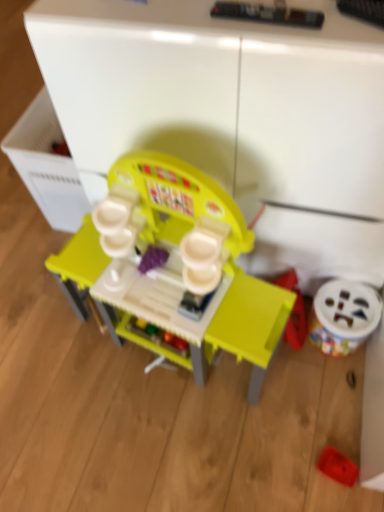
The image size is (384, 512). Find the location of `vacant space positioned to the left of white plastic toy at lower right, the third toy when ordered from left to right`. vacant space positioned to the left of white plastic toy at lower right, the third toy when ordered from left to right is located at coordinates (289, 366).